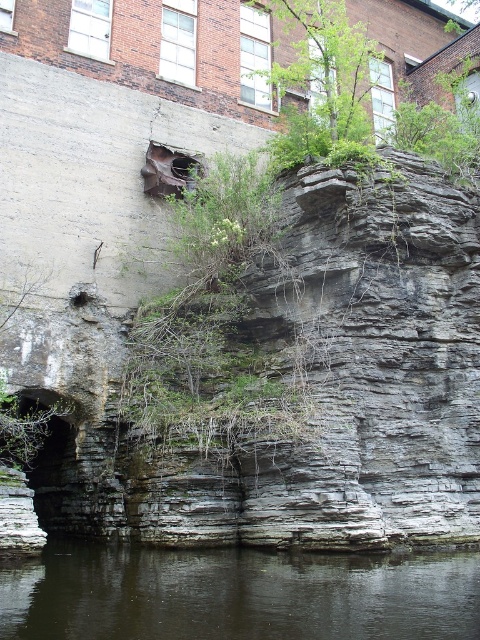
You are a hiker who wants to cross the dark gray water at lower center. You see the green leafy tree at upper center above it. Is the tree blocking your path to the water?

The dark gray water at lower center is positioned under the green leafy tree at upper center, so the tree is above the water and not blocking the path. You can safely cross the water.